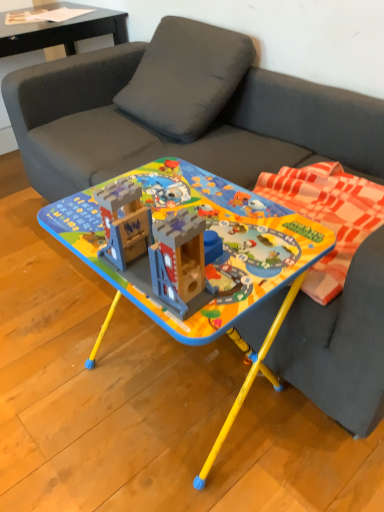
Identify the location of black glossy side table at upper left. Image resolution: width=384 pixels, height=512 pixels. (64, 40).

What do you see at coordinates (64, 40) in the screenshot? I see `black glossy side table at upper left` at bounding box center [64, 40].

This screenshot has width=384, height=512. What do you see at coordinates (206, 231) in the screenshot?
I see `matte plastic table at center, acting as the 1th table starting from the front` at bounding box center [206, 231].

What do you see at coordinates (62, 30) in the screenshot? This screenshot has width=384, height=512. I see `matte black paper at upper left, which is the 2th table in front-to-back order` at bounding box center [62, 30].

Where is `black glossy side table at upper left`? This screenshot has width=384, height=512. black glossy side table at upper left is located at coordinates (64, 40).

Relative to matte black paper at upper left, acting as the 2th table starting from the bottom, is plaid fabric blanket at right in front or behind?

plaid fabric blanket at right is in front of matte black paper at upper left, acting as the 2th table starting from the bottom.

From a real-world perspective, is plaid fabric blanket at right physically above matte black paper at upper left, arranged as the first table when viewed from the back?

Actually, plaid fabric blanket at right is physically below matte black paper at upper left, arranged as the first table when viewed from the back, in the real world.

In terms of size, does plaid fabric blanket at right appear bigger or smaller than matte black paper at upper left, which is the 2th table in front-to-back order?

In the image, plaid fabric blanket at right appears to be larger than matte black paper at upper left, which is the 2th table in front-to-back order.

Is point (325, 224) closer or farther from the camera than point (79, 23)?

Clearly, point (325, 224) is closer to the camera than point (79, 23).

Is black glossy side table at upper left in front of or behind matte black paper at upper left, placed as the 1th table when sorted from top to bottom, in the image?

In the image, black glossy side table at upper left appears in front of matte black paper at upper left, placed as the 1th table when sorted from top to bottom.

Considering the relative positions of black glossy side table at upper left and matte black paper at upper left, which is the 2th table in front-to-back order, in the image provided, is black glossy side table at upper left to the right of matte black paper at upper left, which is the 2th table in front-to-back order, from the viewer's perspective?

No.

From a real-world perspective, between black glossy side table at upper left and matte black paper at upper left, placed as the 1th table when sorted from top to bottom, who is vertically lower?

black glossy side table at upper left is physically lower.

Is black glossy side table at upper left thinner than matte black paper at upper left, the first table in the left-to-right sequence?

In fact, black glossy side table at upper left might be wider than matte black paper at upper left, the first table in the left-to-right sequence.

From the picture: Considering the positions of objects black glossy side table at upper left and plaid fabric blanket at right in the image provided, who is in front, black glossy side table at upper left or plaid fabric blanket at right?

plaid fabric blanket at right.

Considering the relative positions of black glossy side table at upper left and plaid fabric blanket at right in the image provided, is black glossy side table at upper left to the left of plaid fabric blanket at right from the viewer's perspective?

Correct, you'll find black glossy side table at upper left to the left of plaid fabric blanket at right.

Can you tell me how much black glossy side table at upper left and plaid fabric blanket at right differ in facing direction?

The angle between the facing direction of black glossy side table at upper left and the facing direction of plaid fabric blanket at right is 90 degrees.

Considering the sizes of matte black paper at upper left, arranged as the first table when viewed from the back, and matte plastic table at center, the 1th table when ordered from right to left, in the image, is matte black paper at upper left, arranged as the first table when viewed from the back, wider or thinner than matte plastic table at center, the 1th table when ordered from right to left,?

matte black paper at upper left, arranged as the first table when viewed from the back, is thinner than matte plastic table at center, the 1th table when ordered from right to left.

Does matte black paper at upper left, placed as the 2th table when sorted from right to left, appear on the right side of matte plastic table at center, acting as the 2th table starting from the top?

Incorrect, matte black paper at upper left, placed as the 2th table when sorted from right to left, is not on the right side of matte plastic table at center, acting as the 2th table starting from the top.

In terms of size, does matte black paper at upper left, the first table in the left-to-right sequence, appear bigger or smaller than matte plastic table at center, positioned as the 2th table in left-to-right order?

Clearly, matte black paper at upper left, the first table in the left-to-right sequence, is smaller in size than matte plastic table at center, positioned as the 2th table in left-to-right order.

Can you tell me how much matte black paper at upper left, placed as the 1th table when sorted from top to bottom, and matte plastic table at center, acting as the 1th table starting from the bottom, differ in facing direction?

matte black paper at upper left, placed as the 1th table when sorted from top to bottom, and matte plastic table at center, acting as the 1th table starting from the bottom, are facing 90 degrees away from each other.

Which is in front, point (278, 184) or point (122, 38)?

Point (278, 184)

Are plaid fabric blanket at right and black glossy side table at upper left far apart?

Yes, plaid fabric blanket at right and black glossy side table at upper left are quite far apart.

Which object is closer to the camera taking this photo, plaid fabric blanket at right or black glossy side table at upper left?

Positioned in front is plaid fabric blanket at right.

Considering the relative sizes of black glossy side table at upper left and matte plastic table at center, acting as the 1th table starting from the front, in the image provided, is black glossy side table at upper left smaller than matte plastic table at center, acting as the 1th table starting from the front,?

No.

How many degrees apart are the facing directions of black glossy side table at upper left and matte plastic table at center, the 1th table when ordered from right to left?

90 degrees separate the facing orientations of black glossy side table at upper left and matte plastic table at center, the 1th table when ordered from right to left.

This screenshot has height=512, width=384. I want to click on table below the black glossy side table at upper left (from a real-world perspective), so click(206, 231).

Are black glossy side table at upper left and matte plastic table at center, acting as the 1th table starting from the front, beside each other?

No, black glossy side table at upper left is not in contact with matte plastic table at center, acting as the 1th table starting from the front.

Does point (222, 215) come behind point (319, 281)?

Yes.

From the image's perspective, who appears lower, matte plastic table at center, marked as the second table in a back-to-front arrangement, or plaid fabric blanket at right?

From the image's view, matte plastic table at center, marked as the second table in a back-to-front arrangement, is below.

How many degrees apart are the facing directions of matte plastic table at center, the 1th table when ordered from right to left, and plaid fabric blanket at right?

The angular difference between matte plastic table at center, the 1th table when ordered from right to left, and plaid fabric blanket at right is 0.000803 degrees.

Which object is thinner, matte plastic table at center, acting as the 2th table starting from the top, or plaid fabric blanket at right?

With smaller width is plaid fabric blanket at right.

You are a GUI agent. You are given a task and a screenshot of the screen. Output one action in this format:
    pyautogui.click(x=<x>, y=<y>)
    Task: Click on the table that is above the plaid fabric blanket at right (from the image's perspective)
    This screenshot has width=384, height=512.
    Given the screenshot: What is the action you would take?
    pyautogui.click(x=62, y=30)

Find the location of a particular element. The width and height of the screenshot is (384, 512). table behind the black glossy side table at upper left is located at coordinates (62, 30).

Based on their spatial positions, is black glossy side table at upper left or matte black paper at upper left, arranged as the first table when viewed from the back, closer to plaid fabric blanket at right?

Among the two, black glossy side table at upper left is located nearer to plaid fabric blanket at right.

Based on their spatial positions, is matte black paper at upper left, placed as the 2th table when sorted from right to left, or matte plastic table at center, marked as the second table in a back-to-front arrangement, closer to black glossy side table at upper left?

The object closer to black glossy side table at upper left is matte black paper at upper left, placed as the 2th table when sorted from right to left.

When comparing their distances from black glossy side table at upper left, does plaid fabric blanket at right or matte black paper at upper left, acting as the 2th table starting from the bottom, seem closer?

The object closer to black glossy side table at upper left is matte black paper at upper left, acting as the 2th table starting from the bottom.

Considering their positions, is matte plastic table at center, positioned as the 2th table in left-to-right order, positioned closer to black glossy side table at upper left than matte black paper at upper left, placed as the 1th table when sorted from top to bottom?

matte black paper at upper left, placed as the 1th table when sorted from top to bottom, is closer to black glossy side table at upper left.

Which object lies nearer to the anchor point matte black paper at upper left, which is the 2th table in front-to-back order, black glossy side table at upper left or plaid fabric blanket at right?

black glossy side table at upper left is closer to matte black paper at upper left, which is the 2th table in front-to-back order.

Which object lies further to the anchor point black glossy side table at upper left, matte black paper at upper left, the first table in the left-to-right sequence, or plaid fabric blanket at right?

The object further to black glossy side table at upper left is plaid fabric blanket at right.

From the image, which object appears to be nearer to matte black paper at upper left, placed as the 1th table when sorted from top to bottom, matte plastic table at center, positioned as the 2th table in left-to-right order, or plaid fabric blanket at right?

Among the two, plaid fabric blanket at right is located nearer to matte black paper at upper left, placed as the 1th table when sorted from top to bottom.

Consider the image. Based on their spatial positions, is matte black paper at upper left, placed as the 2th table when sorted from right to left, or matte plastic table at center, marked as the second table in a back-to-front arrangement, closer to plaid fabric blanket at right?

matte plastic table at center, marked as the second table in a back-to-front arrangement.

Where is `blanket between matte black paper at upper left, which is the 2th table in front-to-back order, and matte plastic table at center, acting as the 2th table starting from the top, in the vertical direction`? The width and height of the screenshot is (384, 512). blanket between matte black paper at upper left, which is the 2th table in front-to-back order, and matte plastic table at center, acting as the 2th table starting from the top, in the vertical direction is located at coordinates (328, 215).

At what (x,y) coordinates should I click in order to perform the action: click on side table between matte black paper at upper left, acting as the 2th table starting from the bottom, and matte plastic table at center, acting as the 1th table starting from the bottom, from top to bottom. Please return your answer as a coordinate pair (x, y). Looking at the image, I should click on (64, 40).